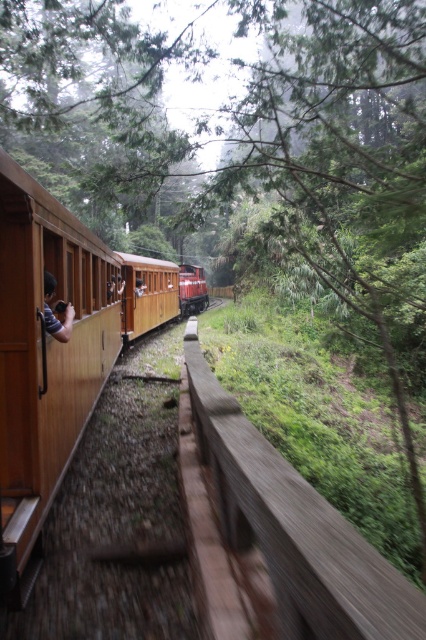
Question: In this image, where is brown wooden rail at center located relative to brown wooden person at left?

Choices:
 (A) left
 (B) right

Answer: (B)

Question: Estimate the real-world distances between objects in this image. Which object is closer to the brown wooden person at left?

Choices:
 (A) brown wooden rail at center
 (B) wooden train at left

Answer: (B)

Question: Does matte red train car at center appear on the right side of wooden door at left?

Choices:
 (A) no
 (B) yes

Answer: (B)

Question: Can you confirm if brown wooden rail at center is positioned above wooden door at left?

Choices:
 (A) no
 (B) yes

Answer: (A)

Question: Which object is the closest to the matte red train car at center?

Choices:
 (A) wooden train at left
 (B) brown wooden rail at center
 (C) brown wooden person at left

Answer: (A)

Question: Which point is farther to the camera?

Choices:
 (A) brown wooden person at left
 (B) brown wooden rail at center
 (C) wooden door at left

Answer: (A)